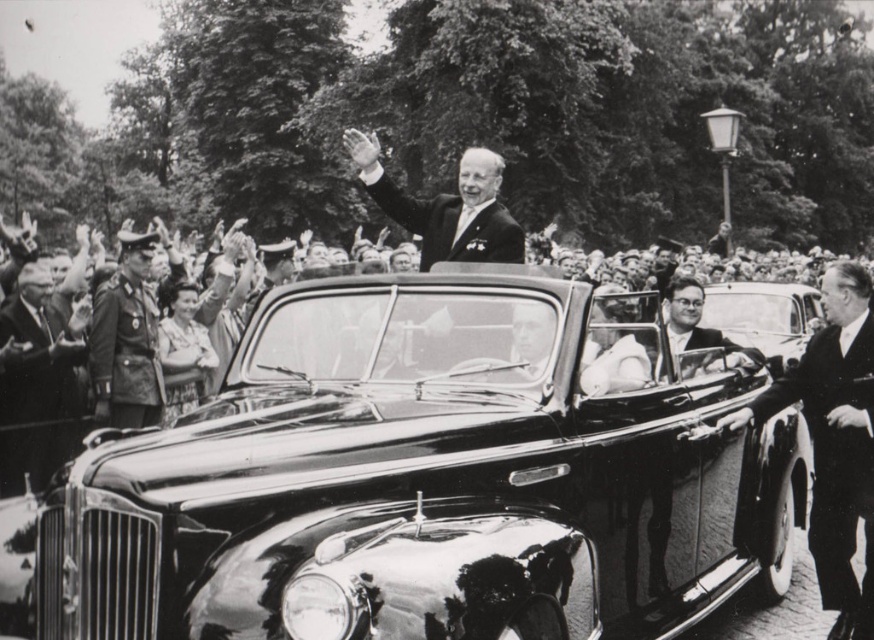
In the scene shown: How much distance is there between smooth black suit at right and dark brown leather uniform at left?

smooth black suit at right is 5.85 meters away from dark brown leather uniform at left.

The width and height of the screenshot is (874, 640). What do you see at coordinates (834, 442) in the screenshot?
I see `smooth black suit at right` at bounding box center [834, 442].

You are a GUI agent. You are given a task and a screenshot of the screen. Output one action in this format:
    pyautogui.click(x=<x>, y=<y>)
    Task: Click on the smooth black suit at right
    The width and height of the screenshot is (874, 640).
    Given the screenshot: What is the action you would take?
    pyautogui.click(x=834, y=442)

Looking at this image, is shiny black car at center taller than smooth black suit at right?

Indeed, shiny black car at center has a greater height compared to smooth black suit at right.

Between point (218, 516) and point (844, 369), which one is positioned behind?

The point (844, 369) is more distant.

Locate an element on the screen. shiny black car at center is located at coordinates click(x=431, y=476).

Which is below, shiny black car at center or dark brown leather uniform at left?

dark brown leather uniform at left

Does shiny black car at center have a greater width compared to dark brown leather uniform at left?

Yes, shiny black car at center is wider than dark brown leather uniform at left.

Is point (475, 364) positioned after point (92, 337)?

No, it is not.

The image size is (874, 640). In order to click on shiny black car at center in this screenshot , I will do `click(431, 476)`.